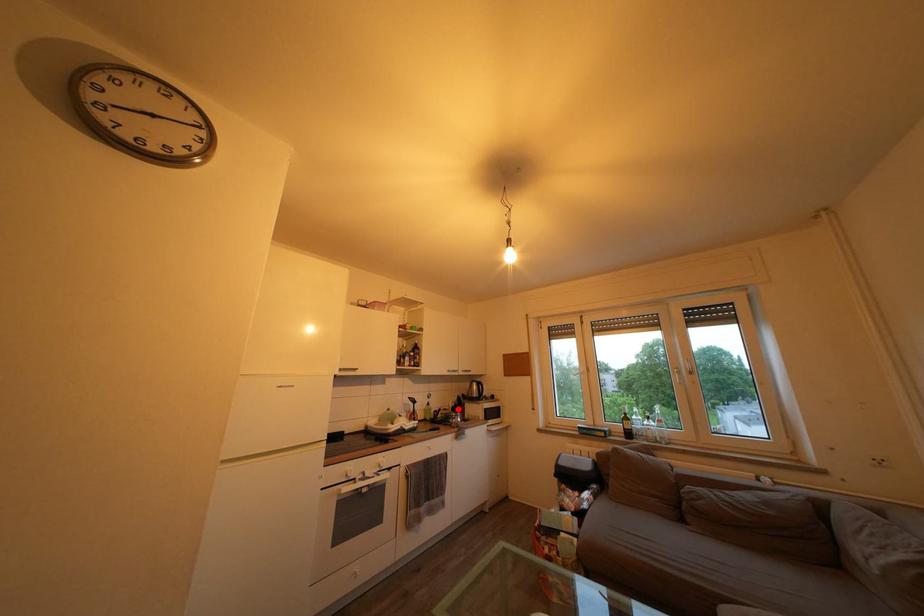
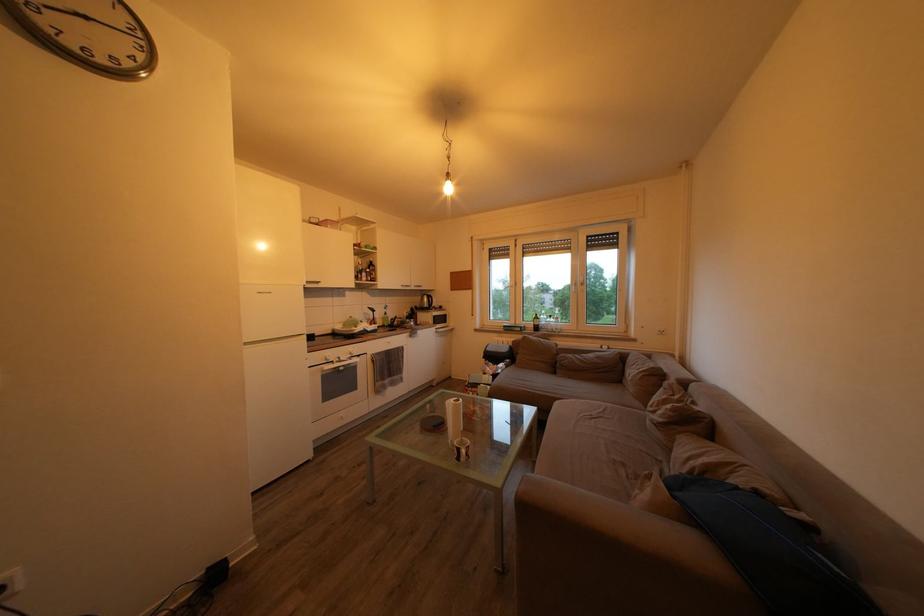
The point at the highlighted location is marked in the first image. Where is the corresponding point in the second image?

(412, 318)